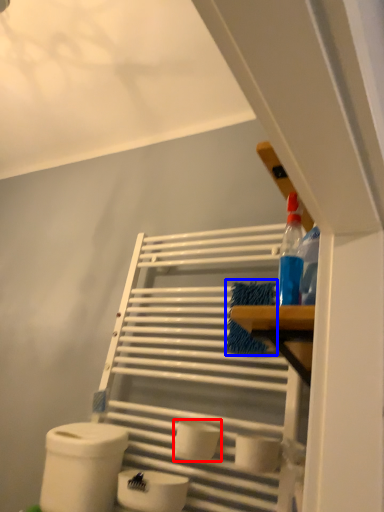
Question: Which object is closer to the camera taking this photo, toilet paper (highlighted by a red box) or material (highlighted by a blue box)?

Choices:
 (A) toilet paper
 (B) material

Answer: (A)